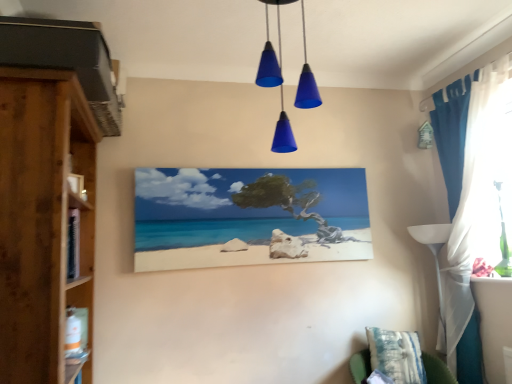
Question: From a real-world perspective, relative to matte canvas painting at center, is wooden cupboard at left vertically above or below?

Choices:
 (A) above
 (B) below

Answer: (B)

Question: Is wooden cupboard at left wider or thinner than matte canvas painting at center?

Choices:
 (A) wide
 (B) thin

Answer: (A)

Question: Estimate the real-world distances between objects in this image. Which object is farther from the wooden cupboard at left?

Choices:
 (A) blue fabric curtain at right
 (B) matte canvas painting at center
 (C) blue striped pillow at lower right
 (D) blue matte cone lights at center

Answer: (A)

Question: Which is nearer to the wooden cupboard at left?

Choices:
 (A) blue striped pillow at lower right
 (B) blue fabric curtain at right
 (C) matte canvas painting at center
 (D) blue matte cone lights at center

Answer: (C)